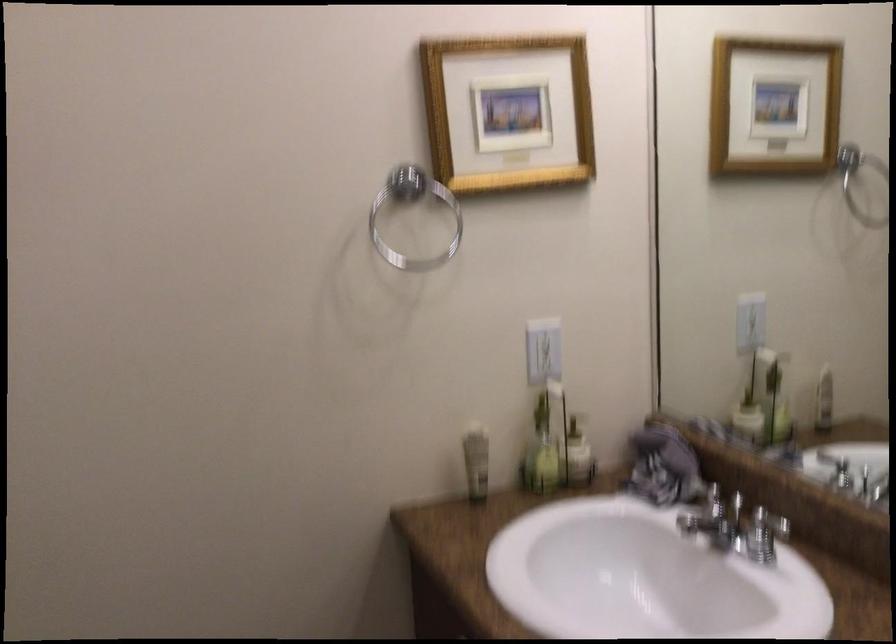
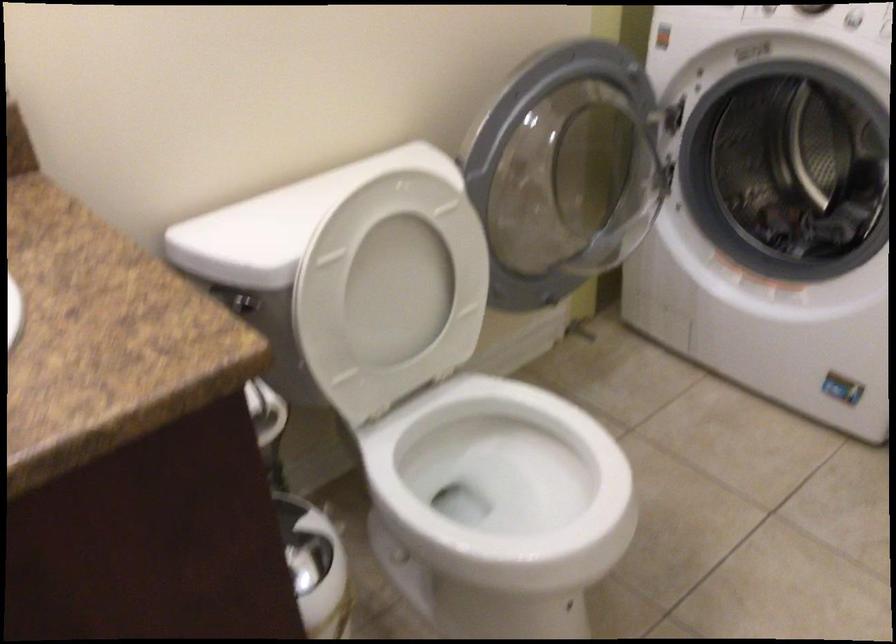
Based on the continuous images, in which direction is the camera rotating?

The camera rotated toward right-down.